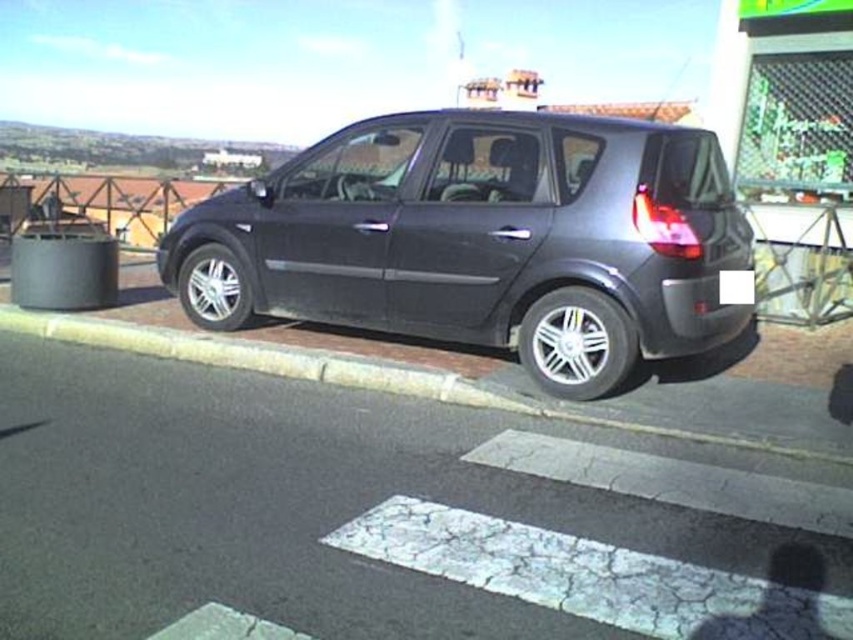
Which is in front, point (364, 179) or point (740, 292)?

Point (740, 292) is more forward.

Who is positioned more to the left, satin black car at center or black plastic license plate at rear?

satin black car at center

Who is more forward, (685, 275) or (732, 275)?

Positioned in front is point (685, 275).

Locate an element on the screen. satin black car at center is located at coordinates (482, 241).

Does satin black car at center appear on the right side of brick at lower center?

Correct, you'll find satin black car at center to the right of brick at lower center.

Is satin black car at center above brick at lower center?

Answer: Yes, satin black car at center is above brick at lower center.

Is point (415, 237) in front of point (120, 330)?

Yes, point (415, 237) is closer to viewer.

You are a GUI agent. You are given a task and a screenshot of the screen. Output one action in this format:
    pyautogui.click(x=<x>, y=<y>)
    Task: Click on the satin black car at center
    Image resolution: width=853 pixels, height=640 pixels.
    Given the screenshot: What is the action you would take?
    pyautogui.click(x=482, y=241)

How far apart are brick at lower center and black plastic license plate at rear?

brick at lower center and black plastic license plate at rear are 1.96 meters apart from each other.

Based on the photo, which is more to the right, brick at lower center or black plastic license plate at rear?

black plastic license plate at rear is more to the right.

Who is more forward, (265,348) or (747,275)?

Positioned in front is point (747,275).

I want to click on brick at lower center, so click(x=345, y=372).